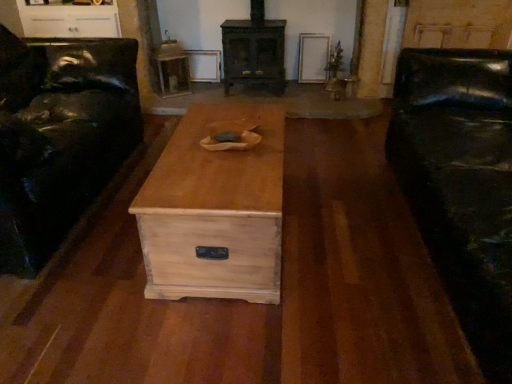
Question: Does natural wood chest at center have a lesser height compared to matte black leather couch at left?

Choices:
 (A) yes
 (B) no

Answer: (A)

Question: Does natural wood chest at center have a lesser width compared to matte black leather couch at left?

Choices:
 (A) no
 (B) yes

Answer: (B)

Question: Are natural wood chest at center and matte black leather couch at left making contact?

Choices:
 (A) yes
 (B) no

Answer: (B)

Question: Is natural wood chest at center in front of matte black leather couch at left?

Choices:
 (A) no
 (B) yes

Answer: (A)

Question: Is natural wood chest at center not close to matte black leather couch at left?

Choices:
 (A) yes
 (B) no

Answer: (B)

Question: From a real-world perspective, is matte black leather couch at left physically located above or below wooden side table at upper center?

Choices:
 (A) below
 (B) above

Answer: (B)

Question: Do you think matte black leather couch at left is within wooden side table at upper center, or outside of it?

Choices:
 (A) inside
 (B) outside

Answer: (B)

Question: Would you say matte black leather couch at left is to the left or to the right of wooden side table at upper center in the picture?

Choices:
 (A) left
 (B) right

Answer: (A)

Question: In terms of width, does matte black leather couch at left look wider or thinner when compared to wooden side table at upper center?

Choices:
 (A) wide
 (B) thin

Answer: (A)

Question: From a real-world perspective, is black leather couch at right above or below natural wood chest at center?

Choices:
 (A) above
 (B) below

Answer: (A)

Question: Considering the positions of black leather couch at right and natural wood chest at center in the image, is black leather couch at right bigger or smaller than natural wood chest at center?

Choices:
 (A) big
 (B) small

Answer: (A)

Question: Looking at their shapes, would you say black leather couch at right is wider or thinner than natural wood chest at center?

Choices:
 (A) thin
 (B) wide

Answer: (B)

Question: From the image's perspective, is black leather couch at right positioned above or below natural wood chest at center?

Choices:
 (A) above
 (B) below

Answer: (A)

Question: From a real-world perspective, relative to natural wood chest at center, is wooden side table at upper center vertically above or below?

Choices:
 (A) above
 (B) below

Answer: (A)

Question: In terms of width, does wooden side table at upper center look wider or thinner when compared to natural wood chest at center?

Choices:
 (A) thin
 (B) wide

Answer: (A)